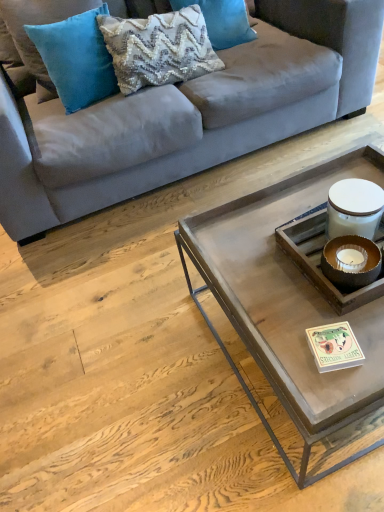
Where is `free space to the left of metallic gray tray at center`? free space to the left of metallic gray tray at center is located at coordinates (124, 364).